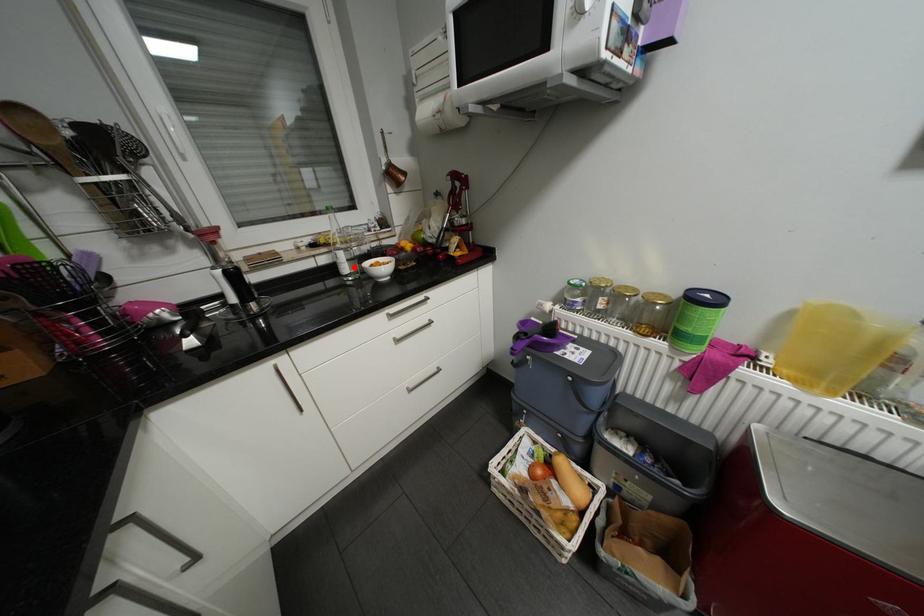
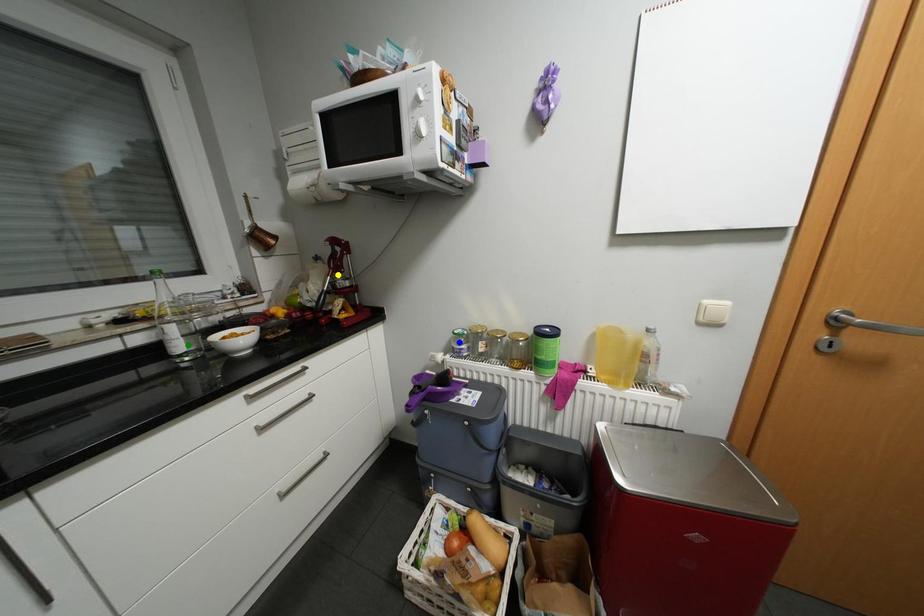
Question: I am providing you with two images of the same scene from different viewpoints. A red point is marked on the first image. You are given multiple points on the second image. Which mark in image 2 goes with the point in image 1?

Choices:
 (A) blue point
 (B) yellow point
 (C) green point

Answer: (C)